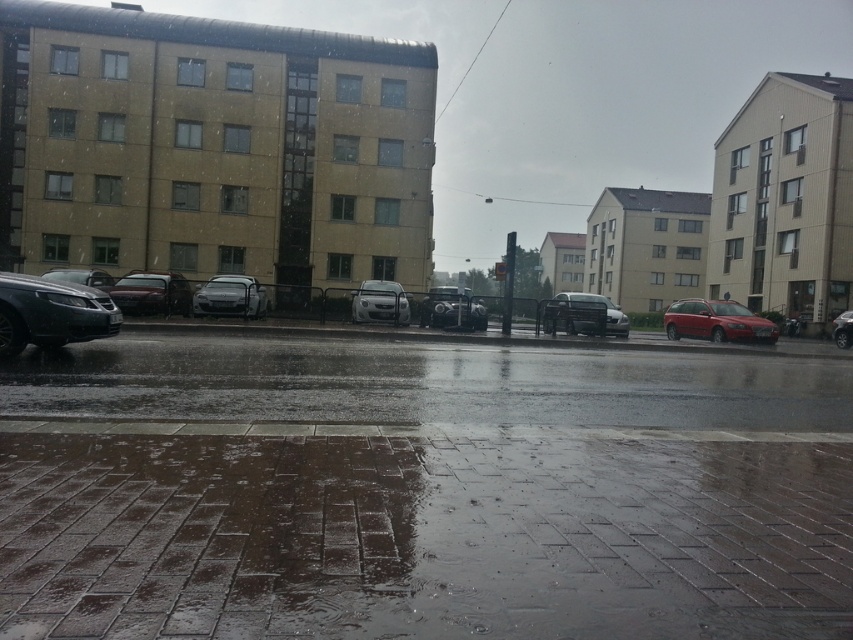
You are a delivery driver who needs to park your vehicle between two satin silver cars in the image. The satin silver sedan at center and the satin silver car at center are both parked along the street. Which one should you park to the right of to ensure proper alignment with the existing vehicles?

You should park to the right of the satin silver sedan at center because it is positioned on the left side of the satin silver car at center, so aligning your vehicle to the right of the sedan would maintain the existing parking order.

You are a delivery person needing to park your vehicle in the narrow space between two parked cars. You see a satin silver car at center and a satin silver sedan at left. Which vehicle should you choose to park next to if you need a thinner vehicle to fit?

The satin silver car at center is thinner than the satin silver sedan at left, so you should park next to the satin silver car at center to ensure there is enough space.